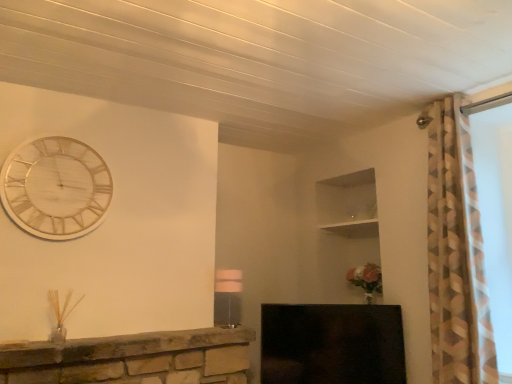
Where is `matte white lampshade at center`? The width and height of the screenshot is (512, 384). matte white lampshade at center is located at coordinates (227, 298).

This screenshot has height=384, width=512. What do you see at coordinates (227, 298) in the screenshot?
I see `matte white lampshade at center` at bounding box center [227, 298].

Measure the distance between black glossy fireplace at lower center and camera.

A distance of 8.88 feet exists between black glossy fireplace at lower center and camera.

Where is `wooden/textured clock at upper left`? The image size is (512, 384). wooden/textured clock at upper left is located at coordinates (56, 188).

Is black glossy fireplace at lower center oriented away from matte white lampshade at center?

black glossy fireplace at lower center is not turned away from matte white lampshade at center.

Identify the location of lamp that is in front of the black glossy fireplace at lower center. (227, 298).

Is black glossy fireplace at lower center not near matte white lampshade at center?

They are positioned close to each other.

Considering the sizes of black glossy fireplace at lower center and matte white lampshade at center in the image, is black glossy fireplace at lower center taller or shorter than matte white lampshade at center?

black glossy fireplace at lower center is taller than matte white lampshade at center.

Looking at this image, is the position of black glossy fireplace at lower center less distant than that of wooden/textured clock at upper left?

No, black glossy fireplace at lower center is further to the viewer.

Is point (383, 367) closer or farther from the camera than point (29, 164)?

Point (383, 367) is farther from the camera than point (29, 164).

Does black glossy fireplace at lower center have a lesser width compared to wooden/textured clock at upper left?

Incorrect, the width of black glossy fireplace at lower center is not less than that of wooden/textured clock at upper left.

Which of these two, black glossy fireplace at lower center or wooden/textured clock at upper left, stands taller?

Standing taller between the two is wooden/textured clock at upper left.

From the picture: Would you say matte white lampshade at center is a long distance from wooden/textured clock at upper left?

Yes.

Does point (237, 289) lie in front of point (42, 170)?

That is False.

From the image's perspective, which one is positioned lower, matte white lampshade at center or wooden/textured clock at upper left?

matte white lampshade at center.

Considering the relative positions of matte white lampshade at center and wooden/textured clock at upper left in the image provided, is matte white lampshade at center behind wooden/textured clock at upper left?

Yes, the depth of matte white lampshade at center is greater than that of wooden/textured clock at upper left.

Considering the sizes of objects matte white lampshade at center and black glossy fireplace at lower center in the image provided, who is thinner, matte white lampshade at center or black glossy fireplace at lower center?

black glossy fireplace at lower center.

From a real-world perspective, who is located lower, matte white lampshade at center or black glossy fireplace at lower center?

In real-world perspective, black glossy fireplace at lower center is lower.

Is point (232, 320) in front of point (326, 313)?

No, (232, 320) is behind (326, 313).

Is matte white lampshade at center next to black glossy fireplace at lower center and touching it?

No, matte white lampshade at center is not with black glossy fireplace at lower center.

From a real-world perspective, is wooden/textured clock at upper left physically located above or below black glossy fireplace at lower center?

wooden/textured clock at upper left is above black glossy fireplace at lower center.

Is point (35, 145) closer to viewer compared to point (398, 332)?

Yes.

What's the angular difference between wooden/textured clock at upper left and black glossy fireplace at lower center's facing directions?

The angular difference between wooden/textured clock at upper left and black glossy fireplace at lower center is 38.7 degrees.

In order to click on fireplace behind the wooden/textured clock at upper left in this screenshot , I will do `click(332, 344)`.

Considering the relative sizes of wooden/textured clock at upper left and matte white lampshade at center in the image provided, is wooden/textured clock at upper left shorter than matte white lampshade at center?

In fact, wooden/textured clock at upper left may be taller than matte white lampshade at center.

Who is more distant, wooden/textured clock at upper left or matte white lampshade at center?

Positioned behind is matte white lampshade at center.

From a real-world perspective, is wooden/textured clock at upper left over matte white lampshade at center?

Correct, in the physical world, wooden/textured clock at upper left is higher than matte white lampshade at center.

Considering the sizes of objects wooden/textured clock at upper left and matte white lampshade at center in the image provided, who is smaller, wooden/textured clock at upper left or matte white lampshade at center?

With smaller size is matte white lampshade at center.

The height and width of the screenshot is (384, 512). In order to click on fireplace behind the matte white lampshade at center in this screenshot , I will do `click(332, 344)`.

This screenshot has width=512, height=384. Identify the location of fireplace lying on the right of wooden/textured clock at upper left. (332, 344).

From the image, which object appears to be nearer to wooden/textured clock at upper left, black glossy fireplace at lower center or matte white lampshade at center?

Among the two, matte white lampshade at center is located nearer to wooden/textured clock at upper left.

Based on their spatial positions, is matte white lampshade at center or wooden/textured clock at upper left further from black glossy fireplace at lower center?

wooden/textured clock at upper left lies further to black glossy fireplace at lower center than the other object.

Looking at the image, which one is located closer to matte white lampshade at center, black glossy fireplace at lower center or wooden/textured clock at upper left?

The object closer to matte white lampshade at center is black glossy fireplace at lower center.

Estimate the real-world distances between objects in this image. Which object is further from wooden/textured clock at upper left, matte white lampshade at center or black glossy fireplace at lower center?

black glossy fireplace at lower center.

Based on the photo, estimate the real-world distances between objects in this image. Which object is closer to black glossy fireplace at lower center, wooden/textured clock at upper left or matte white lampshade at center?

matte white lampshade at center is positioned closer to the anchor black glossy fireplace at lower center.

Which object lies nearer to the anchor point matte white lampshade at center, wooden/textured clock at upper left or black glossy fireplace at lower center?

Based on the image, black glossy fireplace at lower center appears to be nearer to matte white lampshade at center.

This screenshot has width=512, height=384. I want to click on lamp between wooden/textured clock at upper left and black glossy fireplace at lower center, so click(227, 298).